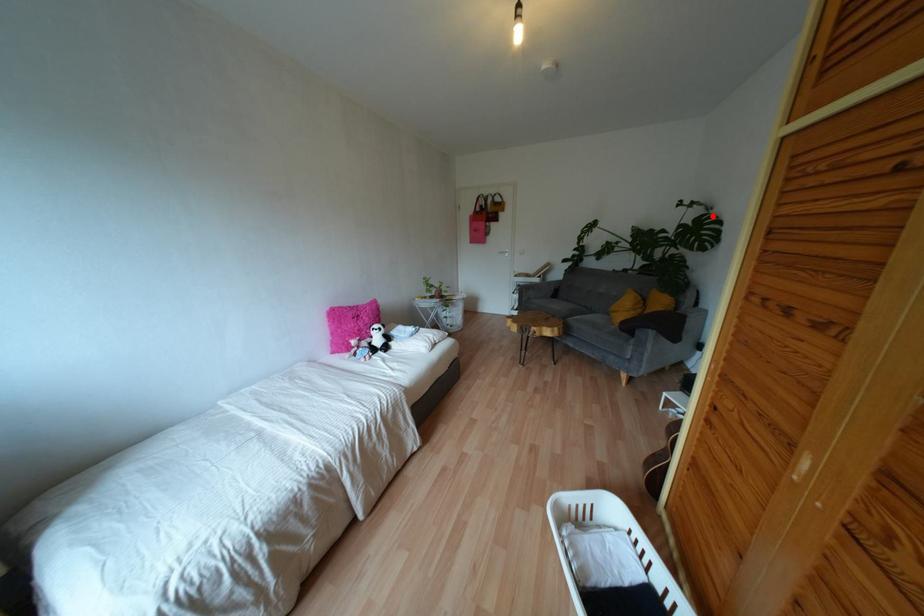
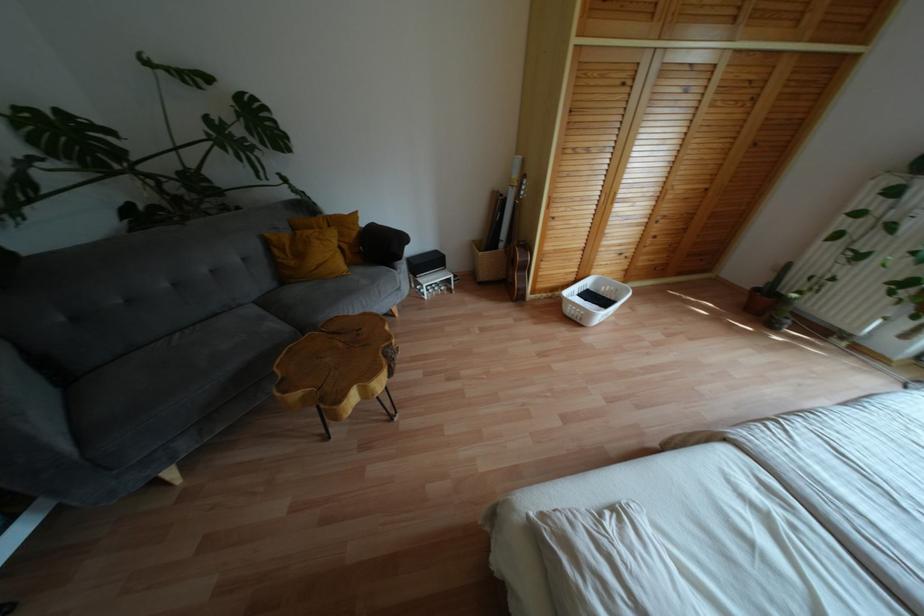
Locate, in the second image, the point that corresponds to the highlighted location in the first image.

(253, 98)